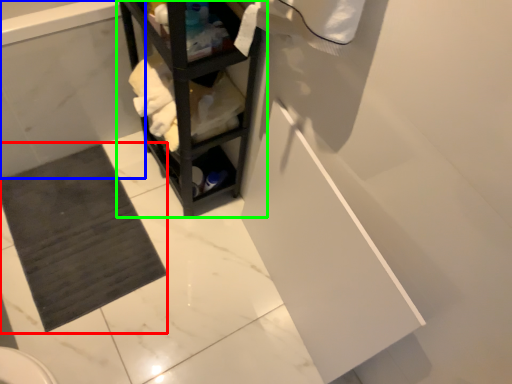
Question: Based on their relative distances, which object is farther from bath mat (highlighted by a red box)? Choose from bath (highlighted by a blue box) and shelf (highlighted by a green box).

Choices:
 (A) bath
 (B) shelf

Answer: (B)